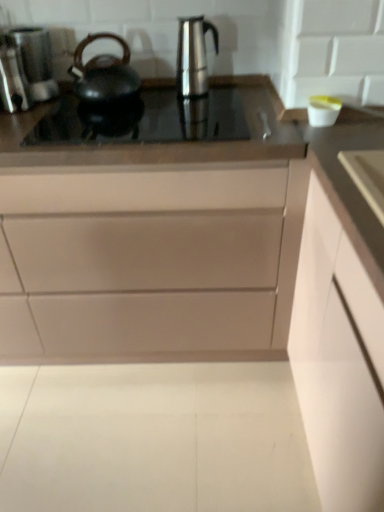
This screenshot has width=384, height=512. Identify the location of black glass cooktop at center. (168, 143).

The image size is (384, 512). I want to click on stainless steel coffee pot at center, so click(193, 56).

What do you see at coordinates (153, 266) in the screenshot?
I see `matte white drawer at center, arranged as the 2th cabinetry when viewed from the right` at bounding box center [153, 266].

What do you see at coordinates (104, 73) in the screenshot?
I see `black matte kettle at left` at bounding box center [104, 73].

I want to click on black matte kettle at left, so click(104, 73).

Find the location of a particular element. This screenshot has height=512, width=384. polished stainless steel coffee machine at left is located at coordinates (26, 69).

The image size is (384, 512). Identify the location of black glass cooktop at center. (168, 143).

Considering the positions of objects white matte cabinet at right, which ranks as the second cabinetry in left-to-right order, and satin nickel faucet at center in the image provided, who is more to the left, white matte cabinet at right, which ranks as the second cabinetry in left-to-right order, or satin nickel faucet at center?

From the viewer's perspective, satin nickel faucet at center appears more on the left side.

Is white matte cabinet at right, which ranks as the second cabinetry in left-to-right order, oriented away from satin nickel faucet at center?

No, satin nickel faucet at center is not at the back of white matte cabinet at right, which ranks as the second cabinetry in left-to-right order.

Considering the sizes of white matte cabinet at right, which ranks as the second cabinetry in left-to-right order, and satin nickel faucet at center in the image, is white matte cabinet at right, which ranks as the second cabinetry in left-to-right order, wider or thinner than satin nickel faucet at center?

white matte cabinet at right, which ranks as the second cabinetry in left-to-right order, is wider than satin nickel faucet at center.

From the image's perspective, which is above, white matte cabinet at right, which ranks as the second cabinetry in left-to-right order, or satin nickel faucet at center?

satin nickel faucet at center appears higher in the image.

Is stainless steel coffee pot at center behind white matte cabinet at right, which is counted as the 1th cabinetry, starting from the right?

Yes, the depth of stainless steel coffee pot at center is greater than that of white matte cabinet at right, which is counted as the 1th cabinetry, starting from the right.

Considering the sizes of stainless steel coffee pot at center and white matte cabinet at right, which ranks as the second cabinetry in left-to-right order, in the image, is stainless steel coffee pot at center bigger or smaller than white matte cabinet at right, which ranks as the second cabinetry in left-to-right order,?

In the image, stainless steel coffee pot at center appears to be smaller than white matte cabinet at right, which ranks as the second cabinetry in left-to-right order.

Considering the relative sizes of stainless steel coffee pot at center and white matte cabinet at right, which ranks as the second cabinetry in left-to-right order, in the image provided, is stainless steel coffee pot at center wider than white matte cabinet at right, which ranks as the second cabinetry in left-to-right order,?

No, stainless steel coffee pot at center is not wider than white matte cabinet at right, which ranks as the second cabinetry in left-to-right order.

Is stainless steel coffee pot at center inside or outside of white matte cabinet at right, which ranks as the second cabinetry in left-to-right order?

The correct answer is: outside.

From the image's perspective, who appears lower, polished stainless steel coffee machine at left or black matte kettle at left?

black matte kettle at left, from the image's perspective.

Is the surface of polished stainless steel coffee machine at left in direct contact with black matte kettle at left?

No, polished stainless steel coffee machine at left is not beside black matte kettle at left.

Does polished stainless steel coffee machine at left have a lesser width compared to black matte kettle at left?

Yes, polished stainless steel coffee machine at left is thinner than black matte kettle at left.

Considering the relative sizes of polished stainless steel coffee machine at left and black matte kettle at left in the image provided, is polished stainless steel coffee machine at left smaller than black matte kettle at left?

Indeed, polished stainless steel coffee machine at left has a smaller size compared to black matte kettle at left.

Is satin nickel faucet at center not near white matte cabinet at right, which is counted as the 1th cabinetry, starting from the right?

That's not correct — satin nickel faucet at center is a little close to white matte cabinet at right, which is counted as the 1th cabinetry, starting from the right.

Is satin nickel faucet at center spatially inside white matte cabinet at right, which ranks as the second cabinetry in left-to-right order, or outside of it?

satin nickel faucet at center is spatially situated outside white matte cabinet at right, which ranks as the second cabinetry in left-to-right order.

Where is `faucet above the white matte cabinet at right, which ranks as the second cabinetry in left-to-right order (from the image's perspective)`? The image size is (384, 512). faucet above the white matte cabinet at right, which ranks as the second cabinetry in left-to-right order (from the image's perspective) is located at coordinates (264, 123).

Between satin nickel faucet at center and white matte cabinet at right, which ranks as the second cabinetry in left-to-right order, which one has more height?

white matte cabinet at right, which ranks as the second cabinetry in left-to-right order, is taller.

Consider the image. From the image's perspective, is stainless steel coffee pot at center located above black glass cooktop at center?

Yes.

Is point (213, 33) positioned behind point (236, 152)?

Yes, point (213, 33) is farther from viewer.

Is stainless steel coffee pot at center positioned with its back to black glass cooktop at center?

That's not correct — stainless steel coffee pot at center is not looking away from black glass cooktop at center.

Considering the sizes of objects stainless steel coffee pot at center and black glass cooktop at center in the image provided, who is taller, stainless steel coffee pot at center or black glass cooktop at center?

stainless steel coffee pot at center is taller.

From the image's perspective, who appears lower, black matte kettle at left or satin nickel faucet at center?

From the image's view, satin nickel faucet at center is below.

Is black matte kettle at left oriented away from satin nickel faucet at center?

black matte kettle at left does not have its back to satin nickel faucet at center.

At what (x,y) coordinates should I click in order to perform the action: click on faucet to the right of black matte kettle at left. Please return your answer as a coordinate pair (x, y). Image resolution: width=384 pixels, height=512 pixels. Looking at the image, I should click on (264, 123).

Is black matte kettle at left shorter than satin nickel faucet at center?

No, black matte kettle at left is not shorter than satin nickel faucet at center.

In the image, is white matte cabinet at right, which is counted as the 1th cabinetry, starting from the right, positioned in front of or behind black glass cooktop at center?

white matte cabinet at right, which is counted as the 1th cabinetry, starting from the right, is in front of black glass cooktop at center.

Is white matte cabinet at right, which is counted as the 1th cabinetry, starting from the right, turned away from black glass cooktop at center?

No, white matte cabinet at right, which is counted as the 1th cabinetry, starting from the right, is not facing away from black glass cooktop at center.

Is white matte cabinet at right, which is counted as the 1th cabinetry, starting from the right, bigger than black glass cooktop at center?

Indeed, white matte cabinet at right, which is counted as the 1th cabinetry, starting from the right, has a larger size compared to black glass cooktop at center.

Image resolution: width=384 pixels, height=512 pixels. I want to click on countertop that appears on the left of white matte cabinet at right, which is counted as the 1th cabinetry, starting from the right, so click(168, 143).

Where is `faucet on the left of white matte cabinet at right, which ranks as the second cabinetry in left-to-right order`? The image size is (384, 512). faucet on the left of white matte cabinet at right, which ranks as the second cabinetry in left-to-right order is located at coordinates (264, 123).

From the image's perspective, count 2nd cabinetrys downward from the stainless steel coffee pot at center and point to it. Please provide its 2D coordinates.

[(338, 361)]

Estimate the real-world distances between objects in this image. Which object is further from stainless steel coffee pot at center, white matte cabinet at right, which is counted as the 1th cabinetry, starting from the right, or black glass cooktop at center?

white matte cabinet at right, which is counted as the 1th cabinetry, starting from the right, is further to stainless steel coffee pot at center.

Based on their spatial positions, is matte white drawer at center, which is counted as the 1th cabinetry, starting from the left, or black matte kettle at left closer to stainless steel coffee pot at center?

black matte kettle at left is positioned closer to the anchor stainless steel coffee pot at center.

When comparing their distances from black matte kettle at left, does white matte cabinet at right, which ranks as the second cabinetry in left-to-right order, or black glass cooktop at center seem further?

Among the two, white matte cabinet at right, which ranks as the second cabinetry in left-to-right order, is located further to black matte kettle at left.

Based on their spatial positions, is black matte kettle at left or matte white drawer at center, which is counted as the 1th cabinetry, starting from the left, further from black glass cooktop at center?

matte white drawer at center, which is counted as the 1th cabinetry, starting from the left, is positioned further to the anchor black glass cooktop at center.

Considering their positions, is matte white drawer at center, which is counted as the 1th cabinetry, starting from the left, positioned further to polished stainless steel coffee machine at left than black glass cooktop at center?

Among the two, matte white drawer at center, which is counted as the 1th cabinetry, starting from the left, is located further to polished stainless steel coffee machine at left.

Looking at the image, which one is located further to polished stainless steel coffee machine at left, satin nickel faucet at center or matte white drawer at center, which is counted as the 1th cabinetry, starting from the left?

Among the two, satin nickel faucet at center is located further to polished stainless steel coffee machine at left.

Looking at the image, which one is located further to black matte kettle at left, white matte cabinet at right, which is counted as the 1th cabinetry, starting from the right, or polished stainless steel coffee machine at left?

Based on the image, white matte cabinet at right, which is counted as the 1th cabinetry, starting from the right, appears to be further to black matte kettle at left.

Consider the image. When comparing their distances from matte white drawer at center, which is counted as the 1th cabinetry, starting from the left, does stainless steel coffee pot at center or polished stainless steel coffee machine at left seem closer?

stainless steel coffee pot at center.

In order to click on countertop situated between black matte kettle at left and stainless steel coffee pot at center from left to right in this screenshot , I will do `click(168, 143)`.

You are a GUI agent. You are given a task and a screenshot of the screen. Output one action in this format:
    pyautogui.click(x=<x>, y=<y>)
    Task: Click on the countertop located between polished stainless steel coffee machine at left and stainless steel coffee pot at center in the left-right direction
    This screenshot has height=512, width=384.
    Given the screenshot: What is the action you would take?
    pyautogui.click(x=168, y=143)

Locate an element on the screen. Image resolution: width=384 pixels, height=512 pixels. kettle between stainless steel coffee pot at center and white matte cabinet at right, which is counted as the 1th cabinetry, starting from the right, from top to bottom is located at coordinates (104, 73).

Locate an element on the screen. This screenshot has width=384, height=512. countertop between stainless steel coffee pot at center and white matte cabinet at right, which is counted as the 1th cabinetry, starting from the right, vertically is located at coordinates (168, 143).